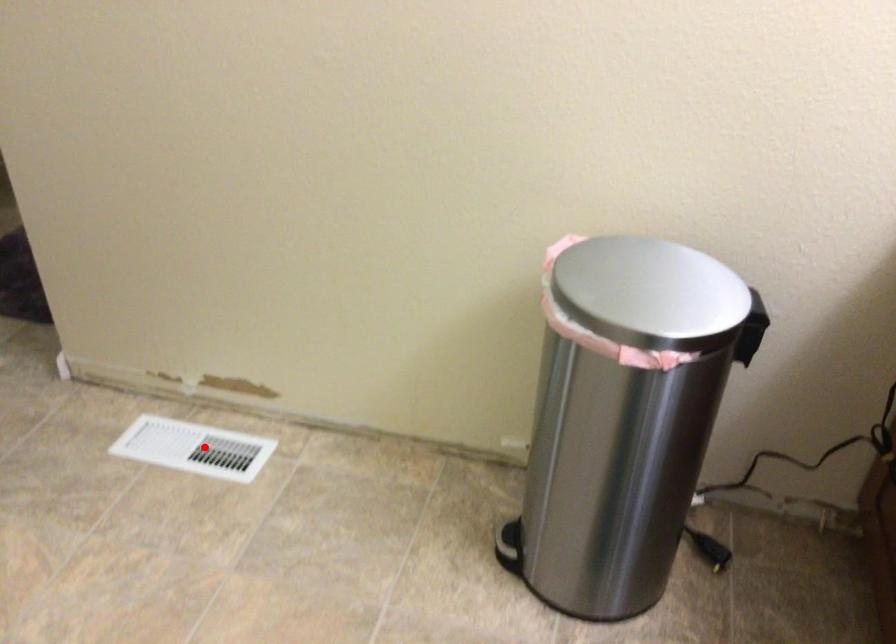
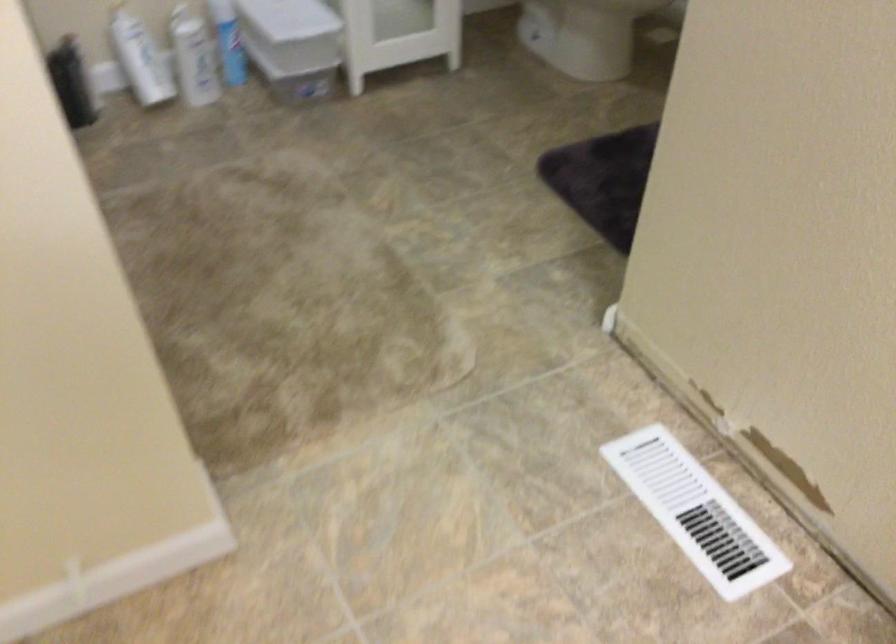
Find the pixel in the second image that matches the highlighted location in the first image.

(695, 512)